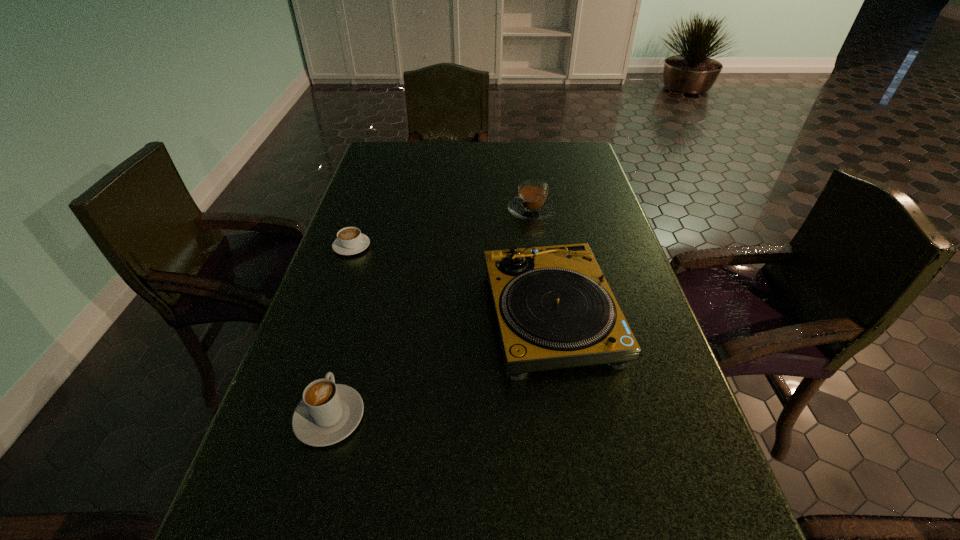
Find the location of a particular element. The width and height of the screenshot is (960, 540). the tallest object is located at coordinates (554, 308).

Locate an element on the screen. This screenshot has width=960, height=540. record player is located at coordinates (554, 308).

Image resolution: width=960 pixels, height=540 pixels. Find the location of `the farthest cappuccino`. the farthest cappuccino is located at coordinates (532, 204).

You are a GUI agent. You are given a task and a screenshot of the screen. Output one action in this format:
    pyautogui.click(x=<x>, y=<y>)
    Task: Click on the rightmost cappuccino
    The height and width of the screenshot is (540, 960).
    Given the screenshot: What is the action you would take?
    pyautogui.click(x=532, y=204)

Find the location of a particular element. The height and width of the screenshot is (540, 960). the nearest object is located at coordinates (328, 412).

Where is `the shortest cappuccino`? This screenshot has width=960, height=540. the shortest cappuccino is located at coordinates (350, 240).

Identify the location of the second nearest cappuccino. Image resolution: width=960 pixels, height=540 pixels. (350, 240).

Find the location of `free space located 0.060m on the right of the third farthest object`. free space located 0.060m on the right of the third farthest object is located at coordinates (643, 315).

You are a GUI agent. You are given a task and a screenshot of the screen. Output one action in this format:
    pyautogui.click(x=<x>, y=<y>)
    Task: Click on the vacant point located on the left of the farthest object
    The image size is (960, 540).
    Given the screenshot: What is the action you would take?
    pyautogui.click(x=416, y=210)

The height and width of the screenshot is (540, 960). Find the location of `vacant space located to the right of the nearest object`. vacant space located to the right of the nearest object is located at coordinates (373, 260).